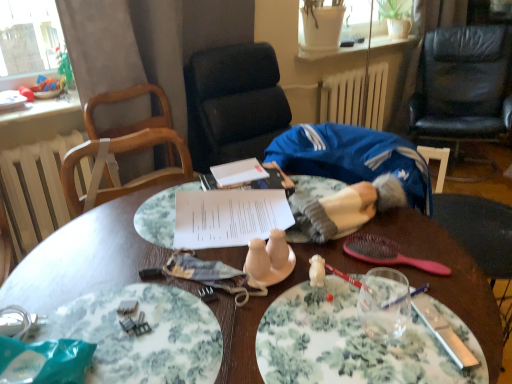
In order to click on free space above floral ceramic plate at center, marked as the first plate in a right-to-left arrangement (from a real-world perspective) in this screenshot , I will do (362, 331).